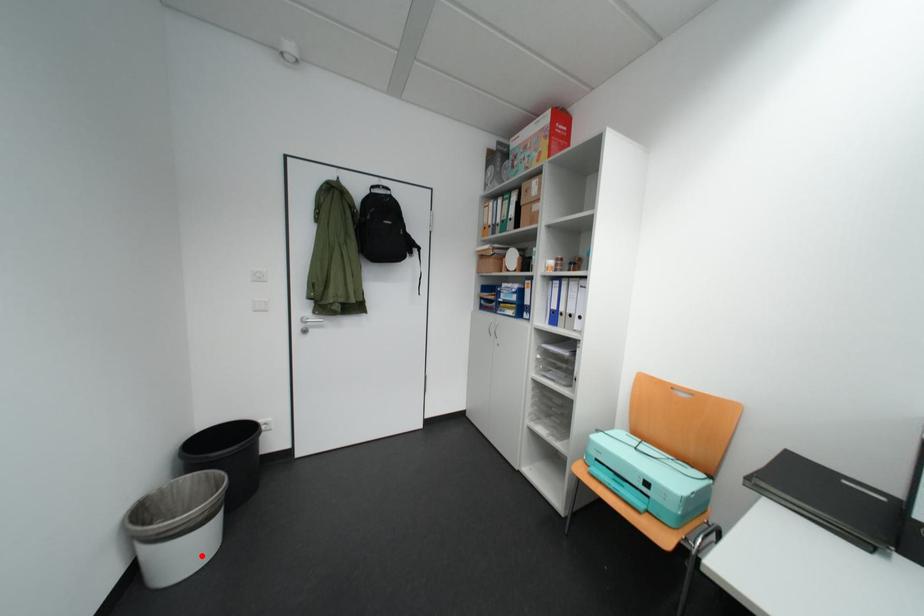
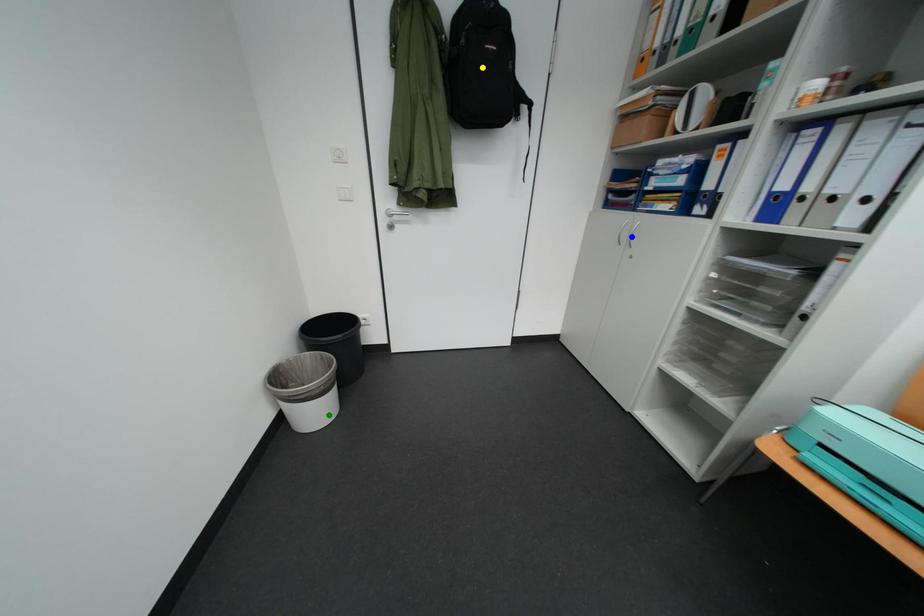
Question: I am providing you with two images of the same scene from different viewpoints. A red point is marked on the first image. You are given multiple points on the second image. Which spot in image 2 lines up with the point in image 1?

Choices:
 (A) green point
 (B) blue point
 (C) yellow point

Answer: (A)